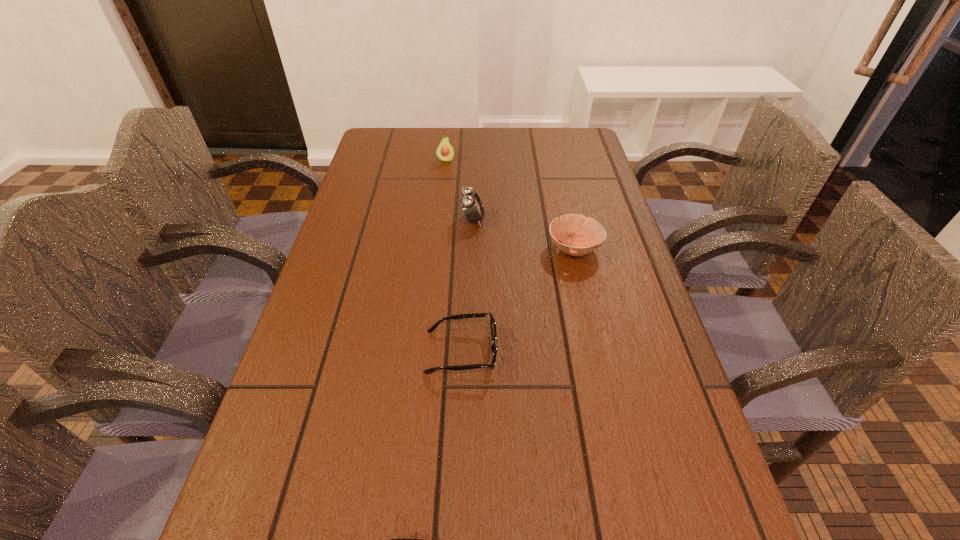
I want to click on free space between the fourth farthest object and the third farthest object, so click(517, 300).

Locate an element on the screen. The image size is (960, 540). unoccupied position between the farthest object and the spectacles is located at coordinates pyautogui.click(x=453, y=256).

Find the location of a particular element. object that can be found as the third closest to the left alarm clock is located at coordinates (472, 206).

You are a GUI agent. You are given a task and a screenshot of the screen. Output one action in this format:
    pyautogui.click(x=<x>, y=<y>)
    Task: Click on the fourth closest object to the farthest object
    
    Given the screenshot: What is the action you would take?
    pyautogui.click(x=402, y=539)

Locate an element on the screen. The width and height of the screenshot is (960, 540). free spot that satisfies the following two spatial constraints: 1. on the cut side of the third farthest object; 2. on the left side of the fourth shortest object is located at coordinates (437, 249).

Image resolution: width=960 pixels, height=540 pixels. Identify the location of vacant space that satisfies the following two spatial constraints: 1. on the cut side of the third nearest object; 2. on the right side of the avocado. (437, 249).